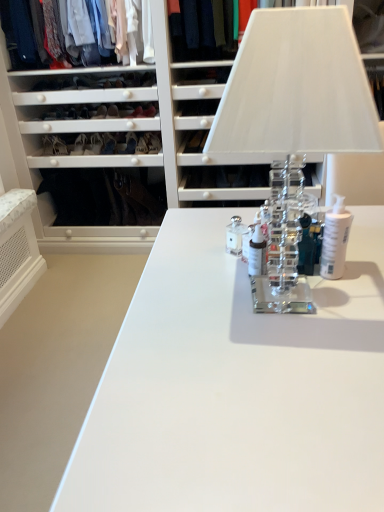
Measure the distance between matte black shoe at center, placed as the 2th shoe when sorted from left to right, and camera.

9.55 feet.

The image size is (384, 512). In order to click on matte black shoe at lower left, the first shoe positioned from the left in this screenshot , I will do `click(46, 146)`.

Describe the element at coordinates (296, 88) in the screenshot. I see `clear glass table lamp at center` at that location.

Measure the distance between point (240, 221) and camera.

A distance of 1.39 meters exists between point (240, 221) and camera.

The image size is (384, 512). What do you see at coordinates (153, 142) in the screenshot?
I see `matte black shoe at center, the 1th shoe positioned from the right` at bounding box center [153, 142].

Where is `matte black shoe at center, the second shoe from the right`? matte black shoe at center, the second shoe from the right is located at coordinates (94, 145).

From a real-world perspective, is dark blue fabric at upper center, the 2th clothing viewed from the left, positioned over matte black shoe at lower left, arranged as the third shoe when viewed from the right, based on gravity?

Correct, in the physical world, dark blue fabric at upper center, the 2th clothing viewed from the left, is higher than matte black shoe at lower left, arranged as the third shoe when viewed from the right.

Is dark blue fabric at upper center, the first clothing positioned from the right, far from matte black shoe at lower left, arranged as the third shoe when viewed from the right?

Absolutely, dark blue fabric at upper center, the first clothing positioned from the right, is distant from matte black shoe at lower left, arranged as the third shoe when viewed from the right.

In the scene shown: Is dark blue fabric at upper center, the first clothing positioned from the right, outside of matte black shoe at lower left, the first shoe positioned from the left?

Yes.

The width and height of the screenshot is (384, 512). In order to click on the 1st shoe below the dark blue fabric at upper center, the 2th clothing viewed from the left (from a real-world perspective) in this screenshot , I will do `click(46, 146)`.

In terms of height, does clear glass table lamp at center look taller or shorter compared to clear glass toiletry at center, arranged as the 1th toiletry when viewed from the left?

Clearly, clear glass table lamp at center is taller compared to clear glass toiletry at center, arranged as the 1th toiletry when viewed from the left.

Image resolution: width=384 pixels, height=512 pixels. Find the location of `the 3rd toiletry behind the clear glass table lamp at center`. the 3rd toiletry behind the clear glass table lamp at center is located at coordinates (235, 234).

Is clear glass table lamp at center not close to clear glass toiletry at center, the 3th toiletry in the right-to-left sequence?

No.

From a real-world perspective, who is located lower, matte white shirts at upper left, the 1th clothing viewed from the left, or white glossy bottle at center, which ranks as the second toiletry in right-to-left order?

white glossy bottle at center, which ranks as the second toiletry in right-to-left order, is physically lower.

Does matte white shirts at upper left, acting as the 2th clothing starting from the right, have a lesser width compared to white glossy bottle at center, which ranks as the second toiletry in right-to-left order?

No.

How different are the orientations of matte white shirts at upper left, the 1th clothing viewed from the left, and white glossy bottle at center, which ranks as the second toiletry in right-to-left order, in degrees?

There is a 90.5-degree angle between the facing directions of matte white shirts at upper left, the 1th clothing viewed from the left, and white glossy bottle at center, which ranks as the second toiletry in right-to-left order.

Looking at this image, which is farther from the camera, (x=49, y=144) or (x=332, y=231)?

Positioned behind is point (x=49, y=144).

From their relative heights in the image, would you say matte black shoe at lower left, arranged as the third shoe when viewed from the right, is taller or shorter than white plastic pump bottle at center, which is counted as the first toiletry, starting from the right?

matte black shoe at lower left, arranged as the third shoe when viewed from the right, is shorter than white plastic pump bottle at center, which is counted as the first toiletry, starting from the right.

Is white plastic pump bottle at center, the 3th toiletry from the left, completely or partially inside matte black shoe at lower left, arranged as the third shoe when viewed from the right?

No, white plastic pump bottle at center, the 3th toiletry from the left, is not a part of matte black shoe at lower left, arranged as the third shoe when viewed from the right.

Considering the positions of objects matte black shoe at lower left, arranged as the third shoe when viewed from the right, and white plastic pump bottle at center, which is counted as the first toiletry, starting from the right, in the image provided, who is behind, matte black shoe at lower left, arranged as the third shoe when viewed from the right, or white plastic pump bottle at center, which is counted as the first toiletry, starting from the right,?

matte black shoe at lower left, arranged as the third shoe when viewed from the right, is further from the camera.

In the image, is white plastic pump bottle at center, which is counted as the first toiletry, starting from the right, positioned in front of or behind matte black shoe at center, the 1th shoe positioned from the right?

white plastic pump bottle at center, which is counted as the first toiletry, starting from the right, is in front of matte black shoe at center, the 1th shoe positioned from the right.

From the image's perspective, is white plastic pump bottle at center, which is counted as the first toiletry, starting from the right, over matte black shoe at center, the 1th shoe positioned from the right?

Actually, white plastic pump bottle at center, which is counted as the first toiletry, starting from the right, appears below matte black shoe at center, the 1th shoe positioned from the right, in the image.

This screenshot has width=384, height=512. I want to click on the 2nd shoe above the white plastic pump bottle at center, which is counted as the first toiletry, starting from the right (from the image's perspective), so click(x=153, y=142).

Is white plastic pump bottle at center, which is counted as the first toiletry, starting from the right, aimed at matte black shoe at center, positioned as the third shoe in left-to-right order?

No, white plastic pump bottle at center, which is counted as the first toiletry, starting from the right, does not turn towards matte black shoe at center, positioned as the third shoe in left-to-right order.

Is the position of matte black shoe at center, the 1th shoe positioned from the right, more distant than that of dark blue fabric at upper center, the first clothing positioned from the right?

That is True.

How many degrees apart are the facing directions of matte black shoe at center, the 1th shoe positioned from the right, and dark blue fabric at upper center, the 2th clothing viewed from the left?

1.3 degrees.

Consider the image. How far apart are matte black shoe at center, the 1th shoe positioned from the right, and dark blue fabric at upper center, the first clothing positioned from the right?

matte black shoe at center, the 1th shoe positioned from the right, and dark blue fabric at upper center, the first clothing positioned from the right, are 28.19 inches apart.

Are matte black shoe at center, the 1th shoe positioned from the right, and dark blue fabric at upper center, the 2th clothing viewed from the left, beside each other?

No, matte black shoe at center, the 1th shoe positioned from the right, is not beside dark blue fabric at upper center, the 2th clothing viewed from the left.

Could you tell me if clear glass toiletry at center, the 3th toiletry in the right-to-left sequence, is facing matte black shoe at lower left, the first shoe positioned from the left?

No, clear glass toiletry at center, the 3th toiletry in the right-to-left sequence, is not turned towards matte black shoe at lower left, the first shoe positioned from the left.

Can matte black shoe at lower left, the first shoe positioned from the left, be found inside clear glass toiletry at center, the 3th toiletry in the right-to-left sequence?

No, clear glass toiletry at center, the 3th toiletry in the right-to-left sequence, does not contain matte black shoe at lower left, the first shoe positioned from the left.

From the image's perspective, is clear glass toiletry at center, the 3th toiletry in the right-to-left sequence, under matte black shoe at lower left, arranged as the third shoe when viewed from the right?

Yes, from the image's perspective, clear glass toiletry at center, the 3th toiletry in the right-to-left sequence, is beneath matte black shoe at lower left, arranged as the third shoe when viewed from the right.

You are a GUI agent. You are given a task and a screenshot of the screen. Output one action in this format:
    pyautogui.click(x=<x>, y=<y>)
    Task: Click on the clothing that is the 1st object above the matte black shoe at lower left, the first shoe positioned from the left (from a real-world perspective)
    
    Given the screenshot: What is the action you would take?
    coord(202,29)

Starting from the clear glass table lamp at center, which toiletry is the 3rd one behind? Please provide its 2D coordinates.

[(235, 234)]

When comparing their distances from matte black shoe at center, the 1th shoe positioned from the right, does clear glass table lamp at center or white plastic pump bottle at center, the 3th toiletry from the left, seem closer?

white plastic pump bottle at center, the 3th toiletry from the left, lies closer to matte black shoe at center, the 1th shoe positioned from the right, than the other object.

Which object lies nearer to the anchor point clear glass toiletry at center, arranged as the 1th toiletry when viewed from the left, matte black shoe at center, the 1th shoe positioned from the right, or matte black shoe at center, the second shoe from the right?

matte black shoe at center, the 1th shoe positioned from the right, is positioned closer to the anchor clear glass toiletry at center, arranged as the 1th toiletry when viewed from the left.

Which object lies nearer to the anchor point matte black shoe at center, the second shoe from the right, clear glass toiletry at center, the 3th toiletry in the right-to-left sequence, or clear glass table lamp at center?

Among the two, clear glass toiletry at center, the 3th toiletry in the right-to-left sequence, is located nearer to matte black shoe at center, the second shoe from the right.

From the image, which object appears to be nearer to matte white shirts at upper left, acting as the 2th clothing starting from the right, matte black shoe at lower left, the first shoe positioned from the left, or clear glass table lamp at center?

matte black shoe at lower left, the first shoe positioned from the left, is closer to matte white shirts at upper left, acting as the 2th clothing starting from the right.

When comparing their distances from white plastic pump bottle at center, the 3th toiletry from the left, does matte black shoe at center, placed as the 2th shoe when sorted from left to right, or matte black shoe at center, positioned as the third shoe in left-to-right order, seem closer?

matte black shoe at center, positioned as the third shoe in left-to-right order.

From the image, which object appears to be farther from clear glass table lamp at center, matte black shoe at center, positioned as the third shoe in left-to-right order, or white plastic pump bottle at center, the 3th toiletry from the left?

The object further to clear glass table lamp at center is matte black shoe at center, positioned as the third shoe in left-to-right order.

Estimate the real-world distances between objects in this image. Which object is further from clear glass toiletry at center, arranged as the 1th toiletry when viewed from the left, matte black shoe at lower left, arranged as the third shoe when viewed from the right, or dark blue fabric at upper center, the 2th clothing viewed from the left?

The object further to clear glass toiletry at center, arranged as the 1th toiletry when viewed from the left, is matte black shoe at lower left, arranged as the third shoe when viewed from the right.

When comparing their distances from matte black shoe at center, placed as the 2th shoe when sorted from left to right, does white glossy bottle at center, which ranks as the second toiletry in right-to-left order, or white plastic pump bottle at center, which is counted as the first toiletry, starting from the right, seem closer?

Based on the image, white glossy bottle at center, which ranks as the second toiletry in right-to-left order, appears to be nearer to matte black shoe at center, placed as the 2th shoe when sorted from left to right.

You are a GUI agent. You are given a task and a screenshot of the screen. Output one action in this format:
    pyautogui.click(x=<x>, y=<y>)
    Task: Click on the shoe between white plastic pump bottle at center, the 3th toiletry from the left, and matte black shoe at center, the second shoe from the right, in the front-back direction
    The image size is (384, 512).
    Given the screenshot: What is the action you would take?
    pyautogui.click(x=153, y=142)

Identify the location of shoe located between matte black shoe at center, placed as the 2th shoe when sorted from left to right, and dark blue fabric at upper center, the 2th clothing viewed from the left, in the left-right direction. (153, 142).

The height and width of the screenshot is (512, 384). Find the location of `clothing between clear glass table lamp at center and matte white shirts at upper left, acting as the 2th clothing starting from the right, in the front-back direction`. clothing between clear glass table lamp at center and matte white shirts at upper left, acting as the 2th clothing starting from the right, in the front-back direction is located at coordinates (202, 29).

Image resolution: width=384 pixels, height=512 pixels. I want to click on clothing situated between matte black shoe at lower left, the first shoe positioned from the left, and dark blue fabric at upper center, the first clothing positioned from the right, from left to right, so click(24, 33).